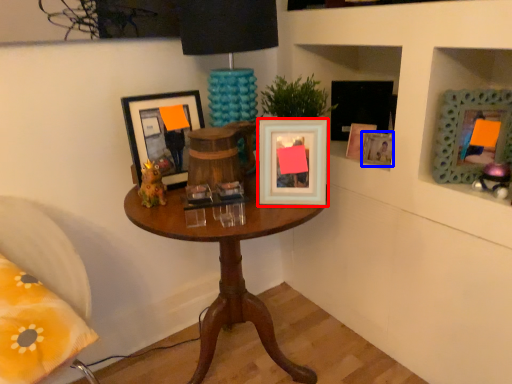
Question: Which object is closer to the camera taking this photo, picture frame (highlighted by a red box) or picture frame (highlighted by a blue box)?

Choices:
 (A) picture frame
 (B) picture frame

Answer: (A)